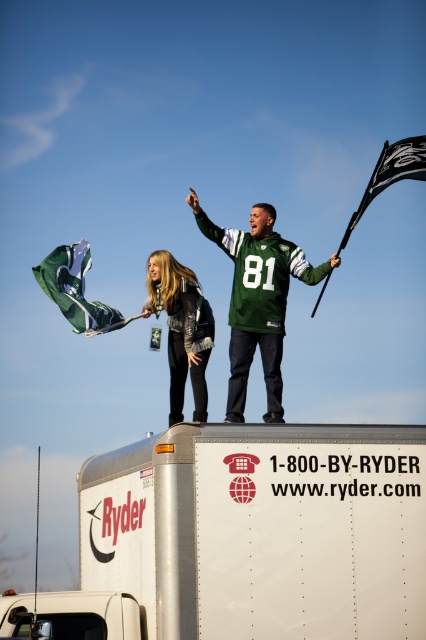
Question: From the image, what is the correct spatial relationship of green fabric flag at upper center in relation to black fabric flag at upper right?

Choices:
 (A) below
 (B) above

Answer: (A)

Question: Is leather jacket at center thinner than green fabric flag at upper center?

Choices:
 (A) yes
 (B) no

Answer: (A)

Question: Does green jersey at center have a greater width compared to black fabric flag at upper right?

Choices:
 (A) no
 (B) yes

Answer: (A)

Question: Which of the following is the closest to the observer?

Choices:
 (A) (233, 349)
 (B) (198, 296)
 (C) (86, 256)

Answer: (B)

Question: Which object appears farthest from the camera in this image?

Choices:
 (A) white matte ryder truck at lower center
 (B) black fabric flag at upper right

Answer: (B)

Question: Estimate the real-world distances between objects in this image. Which object is closer to the green fabric flag at upper center?

Choices:
 (A) green jersey at center
 (B) white matte ryder truck at lower center

Answer: (A)